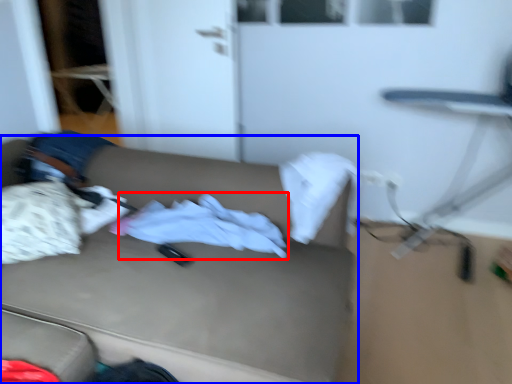
Question: Which of the following is the closest to the observer, baby clothe (highlighted by a red box) or studio couch (highlighted by a blue box)?

Choices:
 (A) baby clothe
 (B) studio couch

Answer: (B)